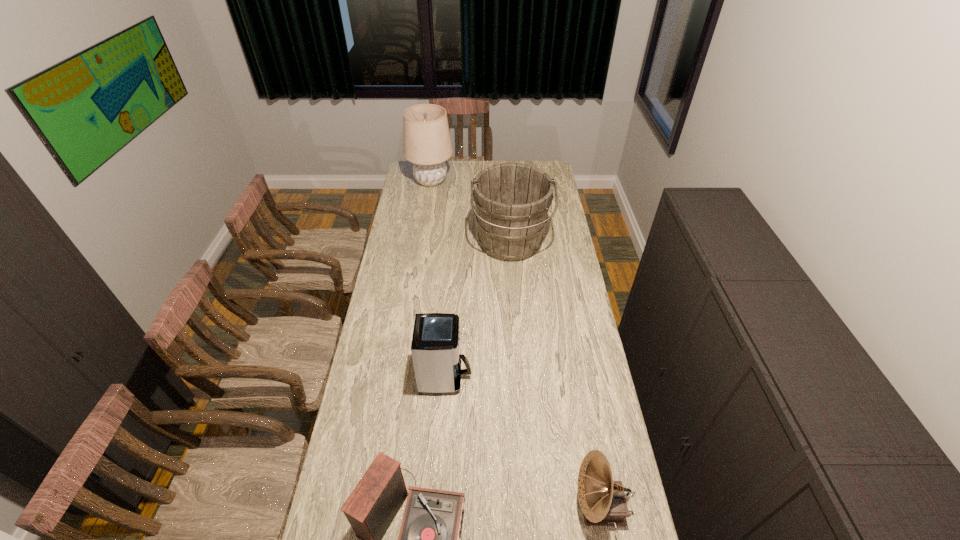
The height and width of the screenshot is (540, 960). Find the location of `object that is at the far left corner`. object that is at the far left corner is located at coordinates (427, 144).

This screenshot has width=960, height=540. I want to click on vacant space at the left edge of the desktop, so click(363, 406).

In the image, there is a desktop. Where is `vacant space at the right edge`? This screenshot has width=960, height=540. vacant space at the right edge is located at coordinates (584, 351).

Where is `vacant point located between the farthest object and the third nearest object`? The width and height of the screenshot is (960, 540). vacant point located between the farthest object and the third nearest object is located at coordinates (439, 279).

Identify the location of free space between the fourth shortest object and the third farthest object. (478, 310).

The width and height of the screenshot is (960, 540). What are the coordinates of `vacant space that is in between the fourth shortest object and the third farthest object` in the screenshot? It's located at (478, 310).

In order to click on free space that is in between the second farthest object and the third farthest object in this screenshot , I will do `click(478, 310)`.

Where is `the third closest object relative to the farthest object`? This screenshot has height=540, width=960. the third closest object relative to the farthest object is located at coordinates (428, 539).

At what (x,y) coordinates should I click in order to perform the action: click on object that is the closest to the shortest object. Please return your answer as a coordinate pair (x, y). The height and width of the screenshot is (540, 960). Looking at the image, I should click on (435, 344).